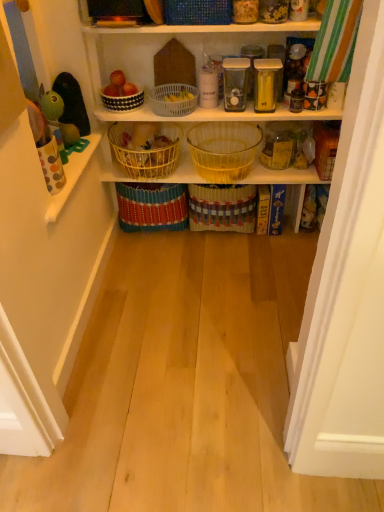
What is the approximate height of woven straw basket at center, which is the 7th basket in top-to-bottom order?

The height of woven straw basket at center, which is the 7th basket in top-to-bottom order, is 32.35 centimeters.

What do you see at coordinates (200, 25) in the screenshot? I see `translucent glass jars at upper center` at bounding box center [200, 25].

How much space does bright yellow woven basket at center, which appears as the 2th basket when ordered from the bottom, occupy horizontally?

The width of bright yellow woven basket at center, which appears as the 2th basket when ordered from the bottom, is 29.55 centimeters.

In order to click on translucent yellow glass basket at center, placed as the third basket when sorted from bottom to top in this screenshot , I will do `click(224, 149)`.

The image size is (384, 512). What are the coordinates of `white plastic basket at upper center, marked as the fifth basket in a bottom-to-top arrangement` in the screenshot? It's located at (173, 99).

You are a GUI agent. You are given a task and a screenshot of the screen. Output one action in this format:
    pyautogui.click(x=<x>, y=<y>)
    Task: Click on the white dotted bowl at upper center, the sixth basket when ordered from bottom to top
    The width and height of the screenshot is (384, 512).
    Given the screenshot: What is the action you would take?
    pyautogui.click(x=123, y=100)

Locate an element on the screen. The width and height of the screenshot is (384, 512). blue woven basket at upper center, arranged as the seventh basket when ordered from the bottom is located at coordinates (197, 12).

Is the depth of white plastic basket at upper center, marked as the fifth basket in a bottom-to-top arrangement, less than that of bright yellow woven basket at center, which appears as the 2th basket when ordered from the bottom?

Yes, it is.

What's the angular difference between white plastic basket at upper center, marked as the fifth basket in a bottom-to-top arrangement, and bright yellow woven basket at center, which appears as the 6th basket when viewed from the top,'s facing directions?

The angle between the facing direction of white plastic basket at upper center, marked as the fifth basket in a bottom-to-top arrangement, and the facing direction of bright yellow woven basket at center, which appears as the 6th basket when viewed from the top, is 0.00278 degrees.

Would you consider white plastic basket at upper center, marked as the fifth basket in a bottom-to-top arrangement, to be distant from bright yellow woven basket at center, which appears as the 6th basket when viewed from the top?

white plastic basket at upper center, marked as the fifth basket in a bottom-to-top arrangement, is near bright yellow woven basket at center, which appears as the 6th basket when viewed from the top, not far away.

Between white plastic basket at upper center, which is counted as the third basket, starting from the top, and bright yellow woven basket at center, which appears as the 2th basket when ordered from the bottom, which one has smaller width?

With smaller width is white plastic basket at upper center, which is counted as the third basket, starting from the top.

Based on their sizes in the image, would you say blue woven basket at upper center, arranged as the seventh basket when ordered from the bottom, is bigger or smaller than translucent glass jars at upper center?

In the image, blue woven basket at upper center, arranged as the seventh basket when ordered from the bottom, appears to be smaller than translucent glass jars at upper center.

Where is `the 1st basket to the left of the translucent glass jars at upper center, counting from the anchor's position`? The height and width of the screenshot is (512, 384). the 1st basket to the left of the translucent glass jars at upper center, counting from the anchor's position is located at coordinates (197, 12).

Do you think blue woven basket at upper center, arranged as the seventh basket when ordered from the bottom, is within translucent glass jars at upper center, or outside of it?

blue woven basket at upper center, arranged as the seventh basket when ordered from the bottom, cannot be found inside translucent glass jars at upper center.

Could you tell me if woven straw basket at center, which is the 7th basket in top-to-bottom order, is facing yellow wire basket at center, positioned as the 4th basket in top-to-bottom order?

No, woven straw basket at center, which is the 7th basket in top-to-bottom order, does not turn towards yellow wire basket at center, positioned as the 4th basket in top-to-bottom order.

Is woven straw basket at center, arranged as the first basket when ordered from the bottom, wider or thinner than yellow wire basket at center, the 4th basket positioned from the bottom?

Considering their sizes, woven straw basket at center, arranged as the first basket when ordered from the bottom, looks slimmer than yellow wire basket at center, the 4th basket positioned from the bottom.

From the image's perspective, which is above, woven straw basket at center, arranged as the first basket when ordered from the bottom, or yellow wire basket at center, the 4th basket positioned from the bottom?

yellow wire basket at center, the 4th basket positioned from the bottom, appears higher in the image.

Which of these two, woven straw basket at center, arranged as the first basket when ordered from the bottom, or blue woven basket at upper center, arranged as the seventh basket when ordered from the bottom, is smaller?

Smaller between the two is blue woven basket at upper center, arranged as the seventh basket when ordered from the bottom.

Does woven straw basket at center, which is the 7th basket in top-to-bottom order, have a lesser height compared to blue woven basket at upper center, arranged as the seventh basket when ordered from the bottom?

In fact, woven straw basket at center, which is the 7th basket in top-to-bottom order, may be taller than blue woven basket at upper center, arranged as the seventh basket when ordered from the bottom.

Relative to blue woven basket at upper center, arranged as the seventh basket when ordered from the bottom, is woven straw basket at center, which is the 7th basket in top-to-bottom order, in front or behind?

In the image, woven straw basket at center, which is the 7th basket in top-to-bottom order, appears behind blue woven basket at upper center, arranged as the seventh basket when ordered from the bottom.

From the image's perspective, is woven straw basket at center, which is the 7th basket in top-to-bottom order, under blue woven basket at upper center, marked as the 1th basket in a top-to-bottom arrangement?

Correct, woven straw basket at center, which is the 7th basket in top-to-bottom order, appears lower than blue woven basket at upper center, marked as the 1th basket in a top-to-bottom arrangement, in the image.

From the image's perspective, between bright yellow woven basket at center, which appears as the 2th basket when ordered from the bottom, and yellow wire basket at center, positioned as the 4th basket in top-to-bottom order, who is located below?

bright yellow woven basket at center, which appears as the 2th basket when ordered from the bottom, from the image's perspective.

Choose the correct answer: Is bright yellow woven basket at center, which appears as the 2th basket when ordered from the bottom, inside yellow wire basket at center, positioned as the 4th basket in top-to-bottom order, or outside it?

bright yellow woven basket at center, which appears as the 2th basket when ordered from the bottom, exists outside the volume of yellow wire basket at center, positioned as the 4th basket in top-to-bottom order.

Considering the sizes of objects bright yellow woven basket at center, which appears as the 2th basket when ordered from the bottom, and yellow wire basket at center, positioned as the 4th basket in top-to-bottom order, in the image provided, who is taller, bright yellow woven basket at center, which appears as the 2th basket when ordered from the bottom, or yellow wire basket at center, positioned as the 4th basket in top-to-bottom order,?

With more height is bright yellow woven basket at center, which appears as the 2th basket when ordered from the bottom.

Is bright yellow woven basket at center, which appears as the 2th basket when ordered from the bottom, bigger than yellow wire basket at center, positioned as the 4th basket in top-to-bottom order?

Indeed, bright yellow woven basket at center, which appears as the 2th basket when ordered from the bottom, has a larger size compared to yellow wire basket at center, positioned as the 4th basket in top-to-bottom order.

Does point (239, 126) come closer to viewer compared to point (148, 187)?

That is True.

From a real-world perspective, relative to bright yellow woven basket at center, which appears as the 6th basket when viewed from the top, is translucent yellow glass basket at center, placed as the third basket when sorted from bottom to top, vertically above or below?

Clearly, from a real-world perspective, translucent yellow glass basket at center, placed as the third basket when sorted from bottom to top, is above bright yellow woven basket at center, which appears as the 6th basket when viewed from the top.

Can you tell me how much translucent yellow glass basket at center, the 5th basket positioned from the top, and bright yellow woven basket at center, which appears as the 6th basket when viewed from the top, differ in facing direction?

The angle between the facing direction of translucent yellow glass basket at center, the 5th basket positioned from the top, and the facing direction of bright yellow woven basket at center, which appears as the 6th basket when viewed from the top, is 0.000376 degrees.

From a real-world perspective, does white dotted bowl at upper center, placed as the second basket when sorted from top to bottom, stand above woven straw basket at center, which is the 7th basket in top-to-bottom order?

Yes, from a real-world perspective, white dotted bowl at upper center, placed as the second basket when sorted from top to bottom, is over woven straw basket at center, which is the 7th basket in top-to-bottom order

Does white dotted bowl at upper center, the sixth basket when ordered from bottom to top, have a lesser height compared to woven straw basket at center, arranged as the first basket when ordered from the bottom?

Indeed, white dotted bowl at upper center, the sixth basket when ordered from bottom to top, has a lesser height compared to woven straw basket at center, arranged as the first basket when ordered from the bottom.

How many degrees apart are the facing directions of white dotted bowl at upper center, placed as the second basket when sorted from top to bottom, and woven straw basket at center, which is the 7th basket in top-to-bottom order?

The angle between the facing direction of white dotted bowl at upper center, placed as the second basket when sorted from top to bottom, and the facing direction of woven straw basket at center, which is the 7th basket in top-to-bottom order, is 0.00123 degrees.

Which object is further away from the camera taking this photo, white dotted bowl at upper center, placed as the second basket when sorted from top to bottom, or woven straw basket at center, which is the 7th basket in top-to-bottom order?

Positioned behind is woven straw basket at center, which is the 7th basket in top-to-bottom order.

Image resolution: width=384 pixels, height=512 pixels. I want to click on the 4th basket located beneath the white plastic basket at upper center, which is counted as the third basket, starting from the top (from a real-world perspective), so click(152, 206).

I want to click on shelf behind the blue woven basket at upper center, marked as the 1th basket in a top-to-bottom arrangement, so click(200, 25).

Considering their positions, is blue woven basket at upper center, marked as the 1th basket in a top-to-bottom arrangement, positioned further to white plastic basket at upper center, which is counted as the third basket, starting from the top, than yellow wire basket at center, positioned as the 4th basket in top-to-bottom order?

blue woven basket at upper center, marked as the 1th basket in a top-to-bottom arrangement, lies further to white plastic basket at upper center, which is counted as the third basket, starting from the top, than the other object.

Looking at the image, which one is located closer to translucent glass jars at upper center, white dotted bowl at upper center, the sixth basket when ordered from bottom to top, or translucent yellow glass basket at center, the 5th basket positioned from the top?

Among the two, white dotted bowl at upper center, the sixth basket when ordered from bottom to top, is located nearer to translucent glass jars at upper center.

Considering their positions, is woven straw basket at center, arranged as the first basket when ordered from the bottom, positioned further to white dotted bowl at upper center, the sixth basket when ordered from bottom to top, than translucent yellow glass basket at center, the 5th basket positioned from the top?

Among the two, woven straw basket at center, arranged as the first basket when ordered from the bottom, is located further to white dotted bowl at upper center, the sixth basket when ordered from bottom to top.

From the image, which object appears to be nearer to bright yellow woven basket at center, which appears as the 2th basket when ordered from the bottom, yellow wire basket at center, the 4th basket positioned from the bottom, or translucent yellow glass basket at center, the 5th basket positioned from the top?

Among the two, yellow wire basket at center, the 4th basket positioned from the bottom, is located nearer to bright yellow woven basket at center, which appears as the 2th basket when ordered from the bottom.

Looking at the image, which one is located closer to translucent glass jars at upper center, bright yellow woven basket at center, which appears as the 6th basket when viewed from the top, or white plastic basket at upper center, marked as the fifth basket in a bottom-to-top arrangement?

white plastic basket at upper center, marked as the fifth basket in a bottom-to-top arrangement.

From the image, which object appears to be farther from woven straw basket at center, arranged as the first basket when ordered from the bottom, blue woven basket at upper center, arranged as the seventh basket when ordered from the bottom, or translucent glass jars at upper center?

blue woven basket at upper center, arranged as the seventh basket when ordered from the bottom, lies further to woven straw basket at center, arranged as the first basket when ordered from the bottom, than the other object.

Considering their positions, is yellow wire basket at center, the 4th basket positioned from the bottom, positioned closer to blue woven basket at upper center, marked as the 1th basket in a top-to-bottom arrangement, than bright yellow woven basket at center, which appears as the 6th basket when viewed from the top?

Among the two, yellow wire basket at center, the 4th basket positioned from the bottom, is located nearer to blue woven basket at upper center, marked as the 1th basket in a top-to-bottom arrangement.

Which object lies nearer to the anchor point white dotted bowl at upper center, the sixth basket when ordered from bottom to top, blue woven basket at upper center, marked as the 1th basket in a top-to-bottom arrangement, or yellow wire basket at center, positioned as the 4th basket in top-to-bottom order?

Based on the image, yellow wire basket at center, positioned as the 4th basket in top-to-bottom order, appears to be nearer to white dotted bowl at upper center, the sixth basket when ordered from bottom to top.

Locate an element on the screen. This screenshot has height=512, width=384. shelf between blue woven basket at upper center, arranged as the seventh basket when ordered from the bottom, and white plastic basket at upper center, marked as the fifth basket in a bottom-to-top arrangement, vertically is located at coordinates (200, 25).

I want to click on shelf between blue woven basket at upper center, marked as the 1th basket in a top-to-bottom arrangement, and yellow wire basket at center, the 4th basket positioned from the bottom, in the vertical direction, so (x=200, y=25).

Find the location of a particular element. The height and width of the screenshot is (512, 384). shelf located between white dotted bowl at upper center, the sixth basket when ordered from bottom to top, and translucent yellow glass basket at center, the 5th basket positioned from the top, in the left-right direction is located at coordinates (200, 25).

Where is `basket between white dotted bowl at upper center, the sixth basket when ordered from bottom to top, and yellow wire basket at center, the 4th basket positioned from the bottom, in the vertical direction`? Image resolution: width=384 pixels, height=512 pixels. basket between white dotted bowl at upper center, the sixth basket when ordered from bottom to top, and yellow wire basket at center, the 4th basket positioned from the bottom, in the vertical direction is located at coordinates (173, 99).